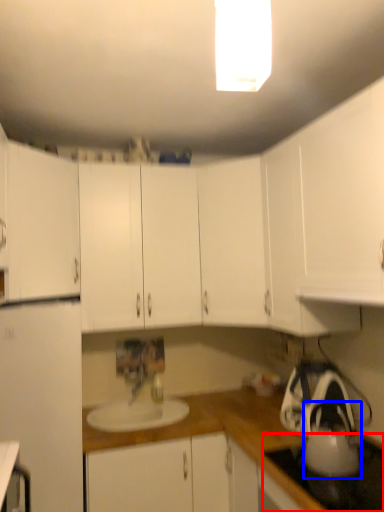
Question: Which of the following is the farthest to the observer, gas stove (highlighted by a red box) or tea pot (highlighted by a blue box)?

Choices:
 (A) gas stove
 (B) tea pot

Answer: (B)